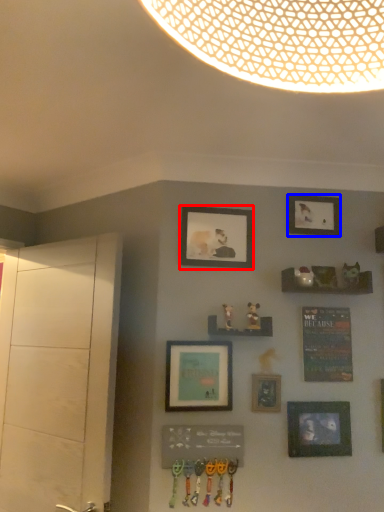
Question: Among these objects, which one is farthest to the camera, picture frame (highlighted by a red box) or picture frame (highlighted by a blue box)?

Choices:
 (A) picture frame
 (B) picture frame

Answer: (B)